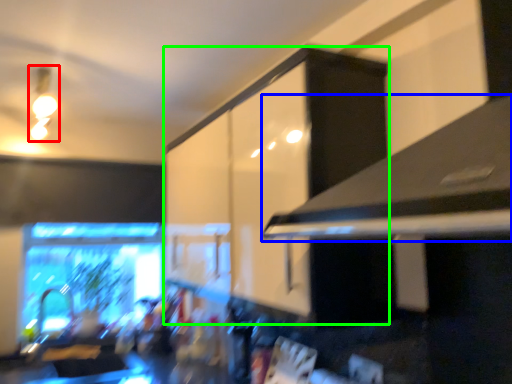
Question: Which is nearer to the light fixture (highlighted by a red box)? exhaust hood (highlighted by a blue box) or cabinetry (highlighted by a green box).

Choices:
 (A) exhaust hood
 (B) cabinetry

Answer: (B)